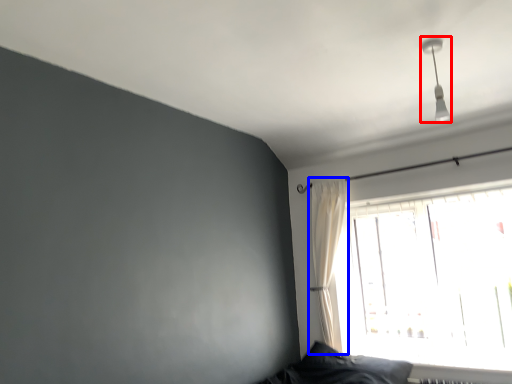
Question: Which object is closer to the camera taking this photo, fixture (highlighted by a red box) or curtain (highlighted by a blue box)?

Choices:
 (A) fixture
 (B) curtain

Answer: (A)